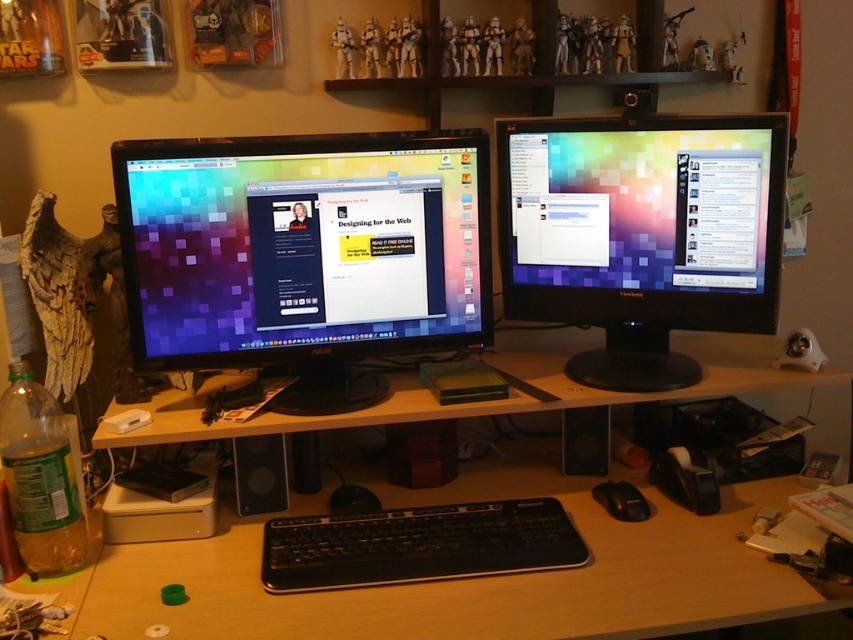
Question: Among these objects, which one is farthest from the camera?

Choices:
 (A) matte black monitor at left
 (B) black plastic keyboard at center
 (C) matte black monitor at center
 (D) wooden at center

Answer: (C)

Question: Which object is positioned closest to the matte black monitor at center?

Choices:
 (A) matte black monitor at left
 (B) black plastic keyboard at center
 (C) wooden at center

Answer: (C)

Question: Which is nearer to the matte black monitor at left?

Choices:
 (A) black plastic keyboard at center
 (B) wooden at center
 (C) matte black monitor at center
 (D) black matte mouse at center

Answer: (C)

Question: Is matte black monitor at center below black plastic keyboard at center?

Choices:
 (A) yes
 (B) no

Answer: (B)

Question: In this image, where is wooden at center located relative to black plastic keyboard at center?

Choices:
 (A) left
 (B) right

Answer: (B)

Question: Is wooden at center positioned behind black matte mouse at center?

Choices:
 (A) no
 (B) yes

Answer: (A)